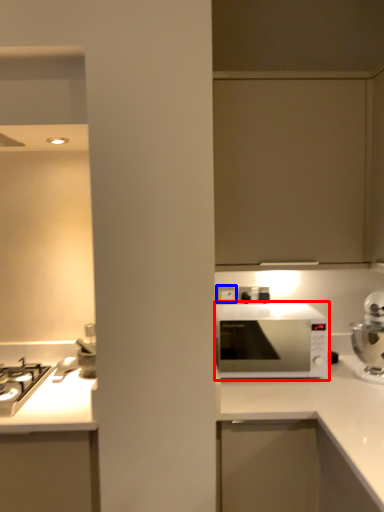
Question: Which point is further to the camera, microwave oven (highlighted by a red box) or electric outlet (highlighted by a blue box)?

Choices:
 (A) microwave oven
 (B) electric outlet

Answer: (B)